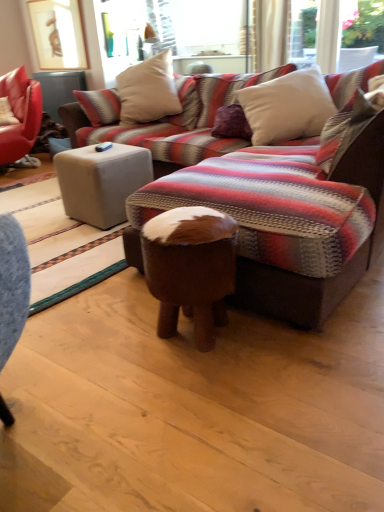
The height and width of the screenshot is (512, 384). What do you see at coordinates (287, 106) in the screenshot?
I see `white soft pillow at upper center, marked as the second pillow in a back-to-front arrangement` at bounding box center [287, 106].

What do you see at coordinates (101, 181) in the screenshot? Image resolution: width=384 pixels, height=512 pixels. I see `beige fabric ottoman at center, acting as the second table starting from the top` at bounding box center [101, 181].

In order to face brown leather stool at center, should I rotate leftwards or rightwards?

A 0.159 degree turn to the right will do.

Locate an element on the screen. Image resolution: width=384 pixels, height=512 pixels. beige fabric pillow at upper center, which is the first pillow in back-to-front order is located at coordinates (148, 90).

Image resolution: width=384 pixels, height=512 pixels. Identify the location of matte white ottoman at center, the second table from the right. (59, 89).

Where is `white soft pillow at upper right, the third pillow viewed from the back`? This screenshot has width=384, height=512. white soft pillow at upper right, the third pillow viewed from the back is located at coordinates (347, 127).

Is white soft pillow at upper center, the second pillow from the front, shorter than beige fabric ottoman at center, the second table in the left-to-right sequence?

No.

In the scene shown: Is the surface of white soft pillow at upper center, marked as the second pillow in a back-to-front arrangement, in direct contact with beige fabric ottoman at center, acting as the 1th table starting from the front?

No, white soft pillow at upper center, marked as the second pillow in a back-to-front arrangement, is not next to beige fabric ottoman at center, acting as the 1th table starting from the front.

Between white soft pillow at upper center, marked as the second pillow in a back-to-front arrangement, and beige fabric ottoman at center, the 1th table ordered from the bottom, which one has larger size?

With larger size is white soft pillow at upper center, marked as the second pillow in a back-to-front arrangement.

From the image's perspective, which is below, beige fabric pillow at upper center, which is the first pillow in back-to-front order, or matte white ottoman at center, the second table from the bottom?

From the image's view, beige fabric pillow at upper center, which is the first pillow in back-to-front order, is below.

What are the coordinates of `table above the beige fabric pillow at upper center, which is the 3th pillow in front-to-back order (from the image's perspective)` in the screenshot? It's located at (59, 89).

Looking at this image, is beige fabric pillow at upper center, which is the 3th pillow in front-to-back order, positioned with its back to matte white ottoman at center, the second table from the bottom?

No.

Between beige fabric pillow at upper center, which is the 3th pillow in front-to-back order, and matte white ottoman at center, acting as the first table starting from the top, which one has larger width?

Wider between the two is beige fabric pillow at upper center, which is the 3th pillow in front-to-back order.

Is white soft pillow at upper center, the second pillow from the front, facing towards brown leather stool at center?

Yes, white soft pillow at upper center, the second pillow from the front, faces towards brown leather stool at center.

Is white soft pillow at upper center, the second pillow from the front, not inside brown leather stool at center?

Yes.

This screenshot has width=384, height=512. Identify the location of the 1st pillow positioned above the brown leather stool at center (from a real-world perspective). (287, 106).

From a real-world perspective, is white soft pillow at upper center, marked as the second pillow in a back-to-front arrangement, below brown leather stool at center?

No, from a real-world perspective, white soft pillow at upper center, marked as the second pillow in a back-to-front arrangement, is not beneath brown leather stool at center.

Based on the photo, which is more to the right, white soft pillow at upper center, marked as the second pillow in a back-to-front arrangement, or beige fabric pillow at upper center, which is the 3th pillow in front-to-back order?

From the viewer's perspective, white soft pillow at upper center, marked as the second pillow in a back-to-front arrangement, appears more on the right side.

Would you consider white soft pillow at upper center, the second pillow from the front, to be distant from beige fabric pillow at upper center, which is the first pillow in back-to-front order?

Yes, white soft pillow at upper center, the second pillow from the front, and beige fabric pillow at upper center, which is the first pillow in back-to-front order, are located far from each other.

Would you say white soft pillow at upper center, the second pillow from the front, contains beige fabric pillow at upper center, which is the 3th pillow in front-to-back order?

Definitely not — beige fabric pillow at upper center, which is the 3th pillow in front-to-back order, is not inside white soft pillow at upper center, the second pillow from the front.

Considering the relative sizes of white soft pillow at upper center, the second pillow from the front, and beige fabric pillow at upper center, which is the first pillow in back-to-front order, in the image provided, is white soft pillow at upper center, the second pillow from the front, shorter than beige fabric pillow at upper center, which is the first pillow in back-to-front order,?

Yes, white soft pillow at upper center, the second pillow from the front, is shorter than beige fabric pillow at upper center, which is the first pillow in back-to-front order.

From the image's perspective, which one is positioned higher, beige fabric ottoman at center, the second table in the left-to-right sequence, or white soft pillow at upper center, the second pillow from the front?

white soft pillow at upper center, the second pillow from the front, is shown above in the image.

From the white soft pillow at upper center, marked as the second pillow in a back-to-front arrangement, count 1st tables backward and point to it. Please provide its 2D coordinates.

[(101, 181)]

Considering the relative positions of beige fabric ottoman at center, which appears as the 2th table when viewed from the back, and white soft pillow at upper center, marked as the second pillow in a back-to-front arrangement, in the image provided, is beige fabric ottoman at center, which appears as the 2th table when viewed from the back, behind white soft pillow at upper center, marked as the second pillow in a back-to-front arrangement,?

Yes, beige fabric ottoman at center, which appears as the 2th table when viewed from the back, is behind white soft pillow at upper center, marked as the second pillow in a back-to-front arrangement.

From a real-world perspective, does beige fabric ottoman at center, the 1th table ordered from the bottom, stand above white soft pillow at upper center, the second pillow from the front?

No.

Is matte white ottoman at center, the second table from the bottom, closer to the viewer compared to brown leather stool at center?

No, matte white ottoman at center, the second table from the bottom, is further to the viewer.

Would you say matte white ottoman at center, the first table from the left, is outside brown leather stool at center?

matte white ottoman at center, the first table from the left, is positioned outside brown leather stool at center.

Can you see matte white ottoman at center, the second table from the bottom, touching brown leather stool at center?

matte white ottoman at center, the second table from the bottom, and brown leather stool at center are clearly separated.

Is matte white ottoman at center, the 2th table when ordered from front to back, aimed at brown leather stool at center?

No, matte white ottoman at center, the 2th table when ordered from front to back, is not aimed at brown leather stool at center.

Which point is more forward, (331, 151) or (124, 161)?

Positioned in front is point (331, 151).

Between white soft pillow at upper right, the third pillow viewed from the back, and beige fabric ottoman at center, which appears as the 2th table when viewed from the back, which one has smaller size?

white soft pillow at upper right, the third pillow viewed from the back, is smaller.

From a real-world perspective, who is located lower, white soft pillow at upper right, which is the 1th pillow in front-to-back order, or beige fabric ottoman at center, the second table in the left-to-right sequence?

beige fabric ottoman at center, the second table in the left-to-right sequence.

How many degrees apart are the facing directions of white soft pillow at upper right, the third pillow viewed from the back, and beige fabric ottoman at center, which appears as the 2th table when viewed from the back?

They differ by 87 degrees in their facing directions.

Find the location of a particular element. the 1st pillow in front of the beige fabric ottoman at center, the 1th table ordered from the bottom, starting your count from the anchor is located at coordinates (287, 106).

From a real-world perspective, which table is the 1st one underneath the beige fabric pillow at upper center, which is the first pillow in back-to-front order? Please provide its 2D coordinates.

[(59, 89)]

Considering their positions, is brown leather stool at center positioned closer to beige fabric ottoman at center, which is the 1th table in right-to-left order, than white soft pillow at upper center, marked as the second pillow in a back-to-front arrangement?

white soft pillow at upper center, marked as the second pillow in a back-to-front arrangement, is closer to beige fabric ottoman at center, which is the 1th table in right-to-left order.

From the picture: Which object lies nearer to the anchor point matte white ottoman at center, the second table from the right, white soft pillow at upper center, the second pillow from the front, or beige fabric pillow at upper center, which is the 3th pillow in front-to-back order?

beige fabric pillow at upper center, which is the 3th pillow in front-to-back order, is closer to matte white ottoman at center, the second table from the right.

Estimate the real-world distances between objects in this image. Which object is further from matte white ottoman at center, the second table from the bottom, beige fabric ottoman at center, the second table in the left-to-right sequence, or white soft pillow at upper center, marked as the second pillow in a back-to-front arrangement?

Among the two, white soft pillow at upper center, marked as the second pillow in a back-to-front arrangement, is located further to matte white ottoman at center, the second table from the bottom.

Based on their spatial positions, is white soft pillow at upper right, the third pillow viewed from the back, or beige fabric ottoman at center, which appears as the 2th table when viewed from the back, closer to beige fabric pillow at upper center, which is the 3th pillow in front-to-back order?

Based on the image, beige fabric ottoman at center, which appears as the 2th table when viewed from the back, appears to be nearer to beige fabric pillow at upper center, which is the 3th pillow in front-to-back order.

Estimate the real-world distances between objects in this image. Which object is closer to beige fabric pillow at upper center, which is the first pillow in back-to-front order, white soft pillow at upper center, the second pillow from the front, or matte white ottoman at center, the first table from the left?

Among the two, white soft pillow at upper center, the second pillow from the front, is located nearer to beige fabric pillow at upper center, which is the first pillow in back-to-front order.

Looking at the image, which one is located further to beige fabric pillow at upper center, which is the 3th pillow in front-to-back order, beige fabric ottoman at center, which is the 1th table in right-to-left order, or white soft pillow at upper center, marked as the second pillow in a back-to-front arrangement?

beige fabric ottoman at center, which is the 1th table in right-to-left order.

Considering their positions, is white soft pillow at upper center, the second pillow from the front, positioned closer to brown leather stool at center than white soft pillow at upper right, the third pillow viewed from the back?

white soft pillow at upper right, the third pillow viewed from the back, lies closer to brown leather stool at center than the other object.

Estimate the real-world distances between objects in this image. Which object is closer to matte white ottoman at center, the first table positioned from the back, white soft pillow at upper center, the second pillow from the front, or white soft pillow at upper right, which is the 1th pillow in front-to-back order?

white soft pillow at upper center, the second pillow from the front.

Image resolution: width=384 pixels, height=512 pixels. I want to click on bar stool between beige fabric ottoman at center, the 1th table ordered from the bottom, and white soft pillow at upper right, the third pillow viewed from the back, in the horizontal direction, so click(190, 269).

Find the location of a particular element. The image size is (384, 512). table between brown leather stool at center and beige fabric pillow at upper center, which is the 3th pillow in front-to-back order, from front to back is located at coordinates (101, 181).

Where is `pillow between white soft pillow at upper right, which is the 1th pillow in front-to-back order, and beige fabric pillow at upper center, which is the first pillow in back-to-front order, along the z-axis`? pillow between white soft pillow at upper right, which is the 1th pillow in front-to-back order, and beige fabric pillow at upper center, which is the first pillow in back-to-front order, along the z-axis is located at coordinates (287, 106).

Find the location of a particular element. The height and width of the screenshot is (512, 384). table between white soft pillow at upper center, the second pillow from the front, and matte white ottoman at center, acting as the first table starting from the top, along the z-axis is located at coordinates (101, 181).